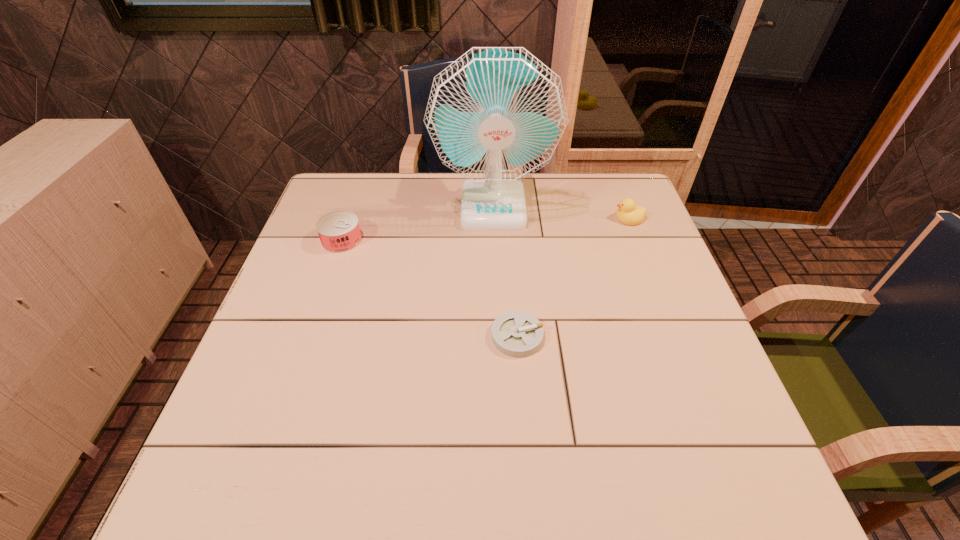
Locate an element on the screen. free spot located 0.060m on the front of the shortest object is located at coordinates (520, 382).

Where is `fan that is at the far edge`? Image resolution: width=960 pixels, height=540 pixels. fan that is at the far edge is located at coordinates (495, 115).

I want to click on duckling located at the far edge, so click(x=628, y=213).

Image resolution: width=960 pixels, height=540 pixels. Identify the location of object that is at the left edge. (339, 231).

Locate an element on the screen. Image resolution: width=960 pixels, height=540 pixels. object situated at the right edge is located at coordinates (628, 213).

The height and width of the screenshot is (540, 960). What are the coordinates of `object that is at the far right corner` in the screenshot? It's located at (628, 213).

The height and width of the screenshot is (540, 960). In the image, there is a desktop. In order to click on vacant region at the far edge in this screenshot , I will do `click(566, 176)`.

You are a GUI agent. You are given a task and a screenshot of the screen. Output one action in this format:
    pyautogui.click(x=<x>, y=<y>)
    Task: Click on the vacant region at the near edge of the desktop
    
    Given the screenshot: What is the action you would take?
    pyautogui.click(x=508, y=456)

In the image, there is a desktop. Identify the location of vacant space at the left edge. (229, 446).

I want to click on vacant area at the right edge, so click(651, 360).